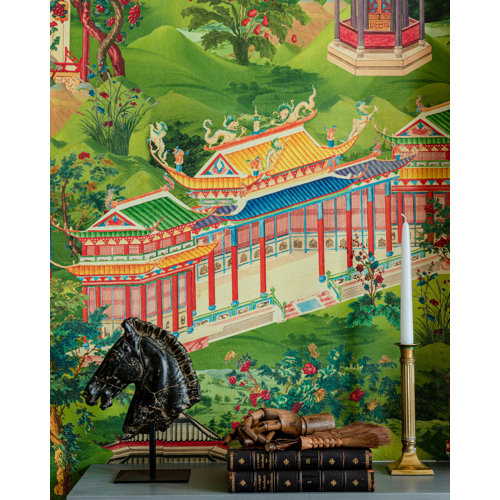
This screenshot has width=500, height=500. I want to click on books, so click(x=277, y=481), click(x=267, y=464).